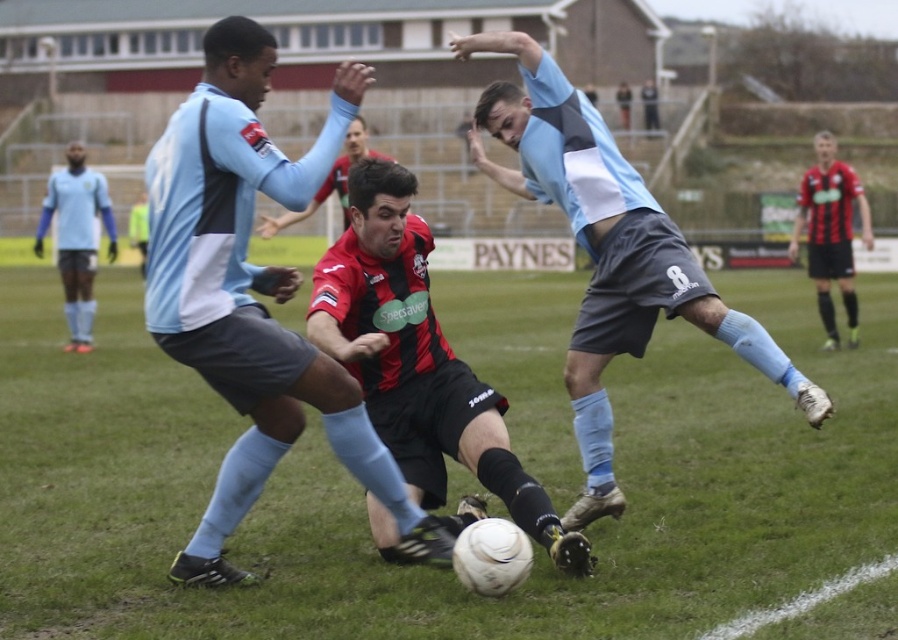
Question: Which point is closer to the camera?

Choices:
 (A) (320, 156)
 (B) (667, 369)
 (C) (599, 355)
 (D) (835, 195)

Answer: (A)

Question: Is green grass at center in front of light blue jersey at center?

Choices:
 (A) no
 (B) yes

Answer: (B)

Question: Is red and black jersey at center wider than matte blue jersey at left?

Choices:
 (A) no
 (B) yes

Answer: (A)

Question: Can you confirm if light blue jersey at center is positioned to the left of matte blue jersey at left?

Choices:
 (A) no
 (B) yes

Answer: (A)

Question: Which of the following is the closest to the observer?

Choices:
 (A) red and black jersey at center
 (B) matte blue jersey at left
 (C) matte blue shorts at center
 (D) light blue jersey at center

Answer: (C)

Question: Considering the real-world distances, which object is farthest from the light blue jersey at center?

Choices:
 (A) matte blue jersey at left
 (B) green grass at center
 (C) matte blue shorts at center
 (D) red and black jersey at center

Answer: (A)